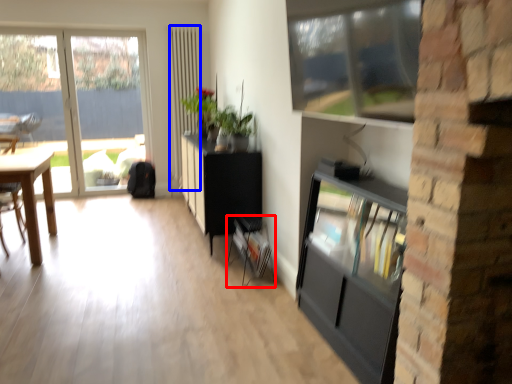
Question: Which point is further to the camera, shelf (highlighted by a red box) or screen door (highlighted by a blue box)?

Choices:
 (A) shelf
 (B) screen door

Answer: (B)